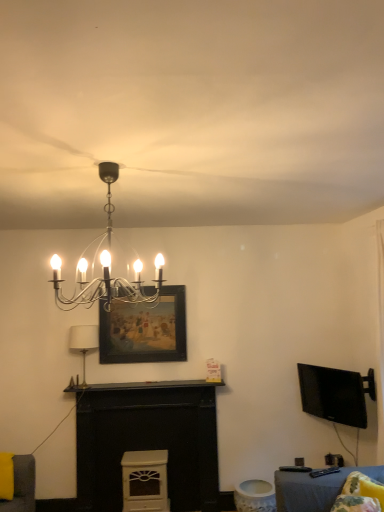
Question: From the image's perspective, does white fabric lampshade at center-left, the second lamp from the front, appear higher than white matte fireplace at center?

Choices:
 (A) yes
 (B) no

Answer: (A)

Question: Does white fabric lampshade at center-left, the second lamp from the front, have a lesser width compared to white matte fireplace at center?

Choices:
 (A) no
 (B) yes

Answer: (A)

Question: Considering the relative positions of white fabric lampshade at center-left, which ranks as the first lamp in left-to-right order, and white matte fireplace at center in the image provided, is white fabric lampshade at center-left, which ranks as the first lamp in left-to-right order, to the left of white matte fireplace at center from the viewer's perspective?

Choices:
 (A) no
 (B) yes

Answer: (B)

Question: Considering the relative sizes of white fabric lampshade at center-left, which ranks as the first lamp in left-to-right order, and white matte fireplace at center in the image provided, is white fabric lampshade at center-left, which ranks as the first lamp in left-to-right order, shorter than white matte fireplace at center?

Choices:
 (A) no
 (B) yes

Answer: (B)

Question: Is white fabric lampshade at center-left, the 2th lamp positioned from the top, behind white matte fireplace at center?

Choices:
 (A) no
 (B) yes

Answer: (B)

Question: Is white fabric lampshade at center-left, the second lamp from the front, positioned far away from white matte fireplace at center?

Choices:
 (A) yes
 (B) no

Answer: (B)

Question: Is polished chrome chandelier at upper center, placed as the first lamp when sorted from top to bottom, bigger than wooden framed painting at center?

Choices:
 (A) no
 (B) yes

Answer: (B)

Question: Can you confirm if polished chrome chandelier at upper center, which is the first lamp in front-to-back order, is thinner than wooden framed painting at center?

Choices:
 (A) yes
 (B) no

Answer: (B)

Question: Considering the relative sizes of polished chrome chandelier at upper center, which ranks as the second lamp in bottom-to-top order, and wooden framed painting at center in the image provided, is polished chrome chandelier at upper center, which ranks as the second lamp in bottom-to-top order, wider than wooden framed painting at center?

Choices:
 (A) no
 (B) yes

Answer: (B)

Question: Is wooden framed painting at center surrounded by polished chrome chandelier at upper center, acting as the first lamp starting from the right?

Choices:
 (A) yes
 (B) no

Answer: (B)

Question: Is polished chrome chandelier at upper center, which ranks as the second lamp in bottom-to-top order, aimed at wooden framed painting at center?

Choices:
 (A) no
 (B) yes

Answer: (A)

Question: Is polished chrome chandelier at upper center, placed as the 2th lamp when sorted from back to front, smaller than wooden framed painting at center?

Choices:
 (A) no
 (B) yes

Answer: (A)

Question: Considering the relative sizes of white matte fireplace at center and black glossy tv at right in the image provided, is white matte fireplace at center wider than black glossy tv at right?

Choices:
 (A) yes
 (B) no

Answer: (A)